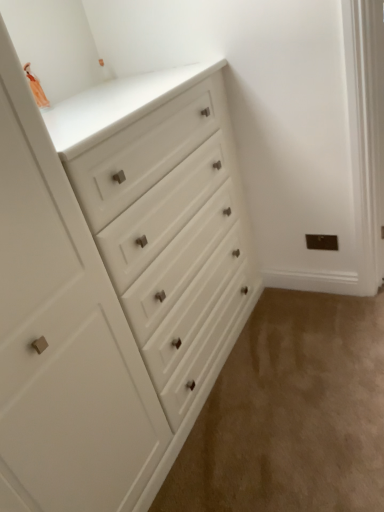
What do you see at coordinates (114, 281) in the screenshot? I see `white matte chest of drawers at upper left` at bounding box center [114, 281].

Identify the location of white matte chest of drawers at upper left. (114, 281).

This screenshot has width=384, height=512. What do you see at coordinates (291, 413) in the screenshot?
I see `beige carpet at lower right` at bounding box center [291, 413].

Find the location of a particular element. beige carpet at lower right is located at coordinates (291, 413).

Measure the distance between point (259, 422) and camera.

Point (259, 422) and camera are 5.33 feet apart from each other.

Identify the location of white matte chest of drawers at upper left. This screenshot has height=512, width=384. (114, 281).

Does beige carpet at lower right appear on the right side of white matte chest of drawers at upper left?

Yes.

Based on the photo, is the position of beige carpet at lower right more distant than that of white matte chest of drawers at upper left?

Yes, the depth of beige carpet at lower right is greater than that of white matte chest of drawers at upper left.

Which is in front, point (210, 500) or point (148, 217)?

Point (148, 217)

From the image's perspective, between beige carpet at lower right and white matte chest of drawers at upper left, who is located below?

From the image's view, beige carpet at lower right is below.

From a real-world perspective, does beige carpet at lower right stand above white matte chest of drawers at upper left?

Actually, beige carpet at lower right is physically below white matte chest of drawers at upper left in the real world.

Looking at their sizes, would you say beige carpet at lower right is wider or thinner than white matte chest of drawers at upper left?

beige carpet at lower right is wider than white matte chest of drawers at upper left.

Which of these two, beige carpet at lower right or white matte chest of drawers at upper left, stands taller?

white matte chest of drawers at upper left is taller.

Looking at this image, can you confirm if beige carpet at lower right is smaller than white matte chest of drawers at upper left?

Correct, beige carpet at lower right occupies less space than white matte chest of drawers at upper left.

Can we say beige carpet at lower right lies outside white matte chest of drawers at upper left?

That's correct, beige carpet at lower right is outside of white matte chest of drawers at upper left.

Are beige carpet at lower right and white matte chest of drawers at upper left making contact?

No, beige carpet at lower right is not next to white matte chest of drawers at upper left.

Is white matte chest of drawers at upper left at the back of beige carpet at lower right?

No, beige carpet at lower right's orientation is not away from white matte chest of drawers at upper left.

How many degrees apart are the facing directions of beige carpet at lower right and white matte chest of drawers at upper left?

0.000749 degrees.

This screenshot has height=512, width=384. I want to click on chest of drawers above the beige carpet at lower right (from the image's perspective), so click(114, 281).

Which is more to the right, white matte chest of drawers at upper left or beige carpet at lower right?

Positioned to the right is beige carpet at lower right.

Which is in front, white matte chest of drawers at upper left or beige carpet at lower right?

white matte chest of drawers at upper left is in front.

Does point (205, 199) lie behind point (332, 504)?

Yes, point (205, 199) is behind point (332, 504).

From the image's perspective, which is above, white matte chest of drawers at upper left or beige carpet at lower right?

white matte chest of drawers at upper left, from the image's perspective.

From a real-world perspective, between white matte chest of drawers at upper left and beige carpet at lower right, who is vertically higher?

From a 3D spatial view, white matte chest of drawers at upper left is above.

Considering the relative sizes of white matte chest of drawers at upper left and beige carpet at lower right in the image provided, is white matte chest of drawers at upper left wider than beige carpet at lower right?

No.

From their relative heights in the image, would you say white matte chest of drawers at upper left is taller or shorter than beige carpet at lower right?

Considering their sizes, white matte chest of drawers at upper left has more height than beige carpet at lower right.

Does white matte chest of drawers at upper left have a larger size compared to beige carpet at lower right?

Indeed, white matte chest of drawers at upper left has a larger size compared to beige carpet at lower right.

From the picture: Is white matte chest of drawers at upper left inside the boundaries of beige carpet at lower right, or outside?

white matte chest of drawers at upper left lies outside beige carpet at lower right.

Is white matte chest of drawers at upper left positioned far away from beige carpet at lower right?

No, there isn't a large distance between white matte chest of drawers at upper left and beige carpet at lower right.

Does white matte chest of drawers at upper left turn towards beige carpet at lower right?

Yes, white matte chest of drawers at upper left is facing beige carpet at lower right.

Can you tell me how much white matte chest of drawers at upper left and beige carpet at lower right differ in facing direction?

The angle between the facing direction of white matte chest of drawers at upper left and the facing direction of beige carpet at lower right is 0.000749 degrees.

Where is `corridor below the white matte chest of drawers at upper left (from a real-world perspective)`? The width and height of the screenshot is (384, 512). corridor below the white matte chest of drawers at upper left (from a real-world perspective) is located at coordinates (291, 413).

Find the location of a particular element. the chest of drawers above the beige carpet at lower right (from a real-world perspective) is located at coordinates (114, 281).

The height and width of the screenshot is (512, 384). Identify the location of corridor lying behind the white matte chest of drawers at upper left. (291, 413).